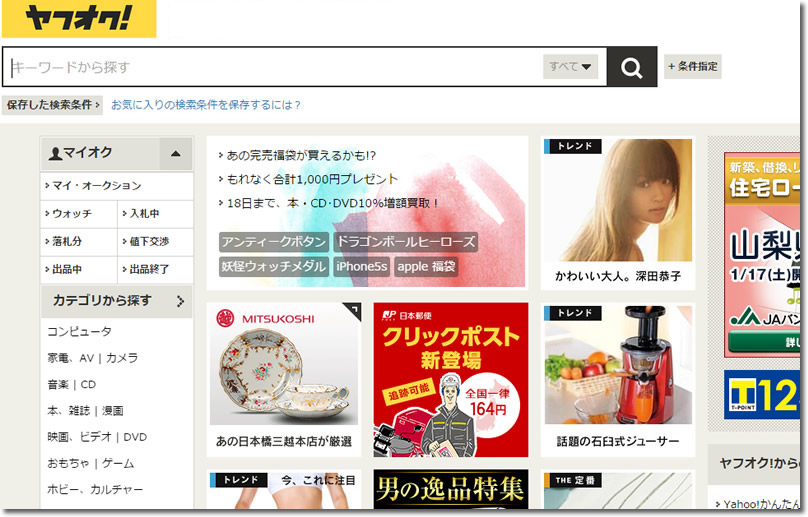
This screenshot has height=517, width=808. I want to click on porcelain dishes, so [300, 397], [299, 409], [241, 370].